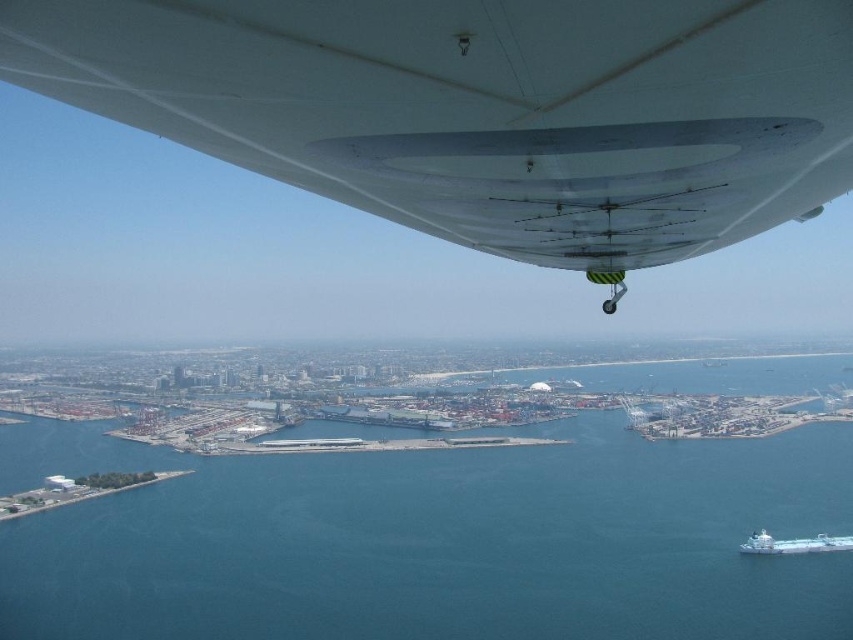
You are a pilot trying to navigate the aircraft to a safe landing. You need to ensure there are no obstructions in the path ahead. Based on the scene, where is the blue water at center located relative to the aircraft?

The blue water at center is located at point (x=433, y=540), which means it is positioned directly ahead and slightly to the right of the aircraft, indicating the landing path is clear over the water.

You are a pilot preparing for landing and need to ensure there is enough space between the white matte wing at upper center and the blue water at center. The minimum required distance for safe landing is 700 feet. Can you confirm if the current distance meets the safety requirement?

The white matte wing at upper center and blue water at center are 743.78 feet apart, which exceeds the minimum required distance of 700 feet for safe landing. Therefore, the current distance meets the safety requirement.

You are a pilot preparing for landing. You notice the white matte wing at upper center. Based on the distance between you and the wing, can you safely adjust your flight path to avoid any obstacles below?

The distance between you and the white matte wing at upper center is 1963.78 feet, which is a safe margin for adjusting your flight path to avoid obstacles below.